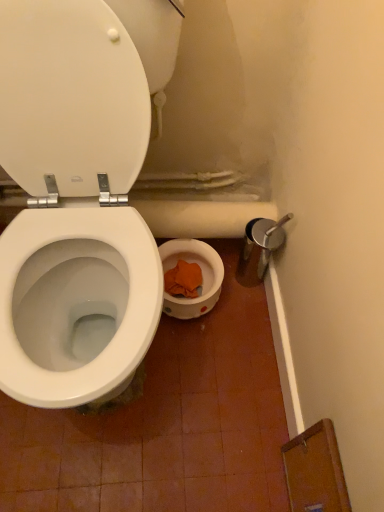
Image resolution: width=384 pixels, height=512 pixels. I want to click on white glossy toilet at center, so click(x=74, y=205).

Describe the element at coordinates (74, 205) in the screenshot. This screenshot has height=512, width=384. I see `white glossy toilet at center` at that location.

Measure the distance between white glossy toilet lid at upper left and camera.

A distance of 27.48 inches exists between white glossy toilet lid at upper left and camera.

Image resolution: width=384 pixels, height=512 pixels. I want to click on white glossy toilet lid at upper left, so click(70, 97).

The width and height of the screenshot is (384, 512). What do you see at coordinates (70, 97) in the screenshot? I see `white glossy toilet lid at upper left` at bounding box center [70, 97].

Find the location of a particular element. The width and height of the screenshot is (384, 512). white glossy toilet at center is located at coordinates (74, 205).

Between white glossy toilet at center and white glossy toilet lid at upper left, which one appears on the left side from the viewer's perspective?

Positioned to the left is white glossy toilet at center.

Is the depth of white glossy toilet at center greater than that of white glossy toilet lid at upper left?

No, white glossy toilet at center is closer to the camera.

Is point (57, 120) positioned in front of point (122, 116)?

No, it is behind (122, 116).

Looking at this image, from the image's perspective, is white glossy toilet at center beneath white glossy toilet lid at upper left?

Yes.

From a real-world perspective, which object stands above the other?

From a 3D spatial view, white glossy toilet at center is above.

Does white glossy toilet at center have a lesser width compared to white glossy toilet lid at upper left?

No.

Considering the relative sizes of white glossy toilet at center and white glossy toilet lid at upper left in the image provided, is white glossy toilet at center shorter than white glossy toilet lid at upper left?

Incorrect, the height of white glossy toilet at center does not fall short of that of white glossy toilet lid at upper left.

Considering the relative sizes of white glossy toilet at center and white glossy toilet lid at upper left in the image provided, is white glossy toilet at center smaller than white glossy toilet lid at upper left?

Incorrect, white glossy toilet at center is not smaller in size than white glossy toilet lid at upper left.

Is white glossy toilet at center outside of white glossy toilet lid at upper left?

Absolutely, white glossy toilet at center is external to white glossy toilet lid at upper left.

Are white glossy toilet at center and white glossy toilet lid at upper left beside each other?

Indeed, white glossy toilet at center and white glossy toilet lid at upper left are beside each other and touching.

Is white glossy toilet at center looking in the opposite direction of white glossy toilet lid at upper left?

That's right, white glossy toilet at center is facing away from white glossy toilet lid at upper left.

You are a GUI agent. You are given a task and a screenshot of the screen. Output one action in this format:
    pyautogui.click(x=<x>, y=<y>)
    Task: Click on the lid above the white glossy toilet at center (from the image's perspective)
    The image size is (384, 512).
    Given the screenshot: What is the action you would take?
    pyautogui.click(x=70, y=97)

Based on their positions, is white glossy toilet lid at upper left located to the left or right of white glossy toilet at center?

Clearly, white glossy toilet lid at upper left is on the right of white glossy toilet at center in the image.

Does white glossy toilet lid at upper left lie behind white glossy toilet at center?

That is True.

Which is farther from the camera, (0, 36) or (122, 140)?

The point (122, 140) is more distant.

From the image's perspective, is white glossy toilet lid at upper left above white glossy toilet at center?

Yes, from the image's perspective, white glossy toilet lid at upper left is on top of white glossy toilet at center.

Consider the image. From a real-world perspective, who is located higher, white glossy toilet lid at upper left or white glossy toilet at center?

white glossy toilet at center is physically above.

In terms of width, does white glossy toilet lid at upper left look wider or thinner when compared to white glossy toilet at center?

Considering their sizes, white glossy toilet lid at upper left looks slimmer than white glossy toilet at center.

Does white glossy toilet lid at upper left have a greater height compared to white glossy toilet at center?

No.

Which of these two, white glossy toilet lid at upper left or white glossy toilet at center, is smaller?

With smaller size is white glossy toilet lid at upper left.

Would you say white glossy toilet lid at upper left is outside white glossy toilet at center?

Actually, white glossy toilet lid at upper left is within white glossy toilet at center.

Is white glossy toilet lid at upper left placed right next to white glossy toilet at center?

Yes, white glossy toilet lid at upper left is right next to white glossy toilet at center and making contact.

Could you tell me if white glossy toilet lid at upper left is turned towards white glossy toilet at center?

Yes.

The image size is (384, 512). I want to click on toilet below the white glossy toilet lid at upper left (from the image's perspective), so click(74, 205).

Where is `lid above the white glossy toilet at center (from the image's perspective)`? lid above the white glossy toilet at center (from the image's perspective) is located at coordinates (70, 97).

The height and width of the screenshot is (512, 384). In order to click on toilet located above the white glossy toilet lid at upper left (from a real-world perspective) in this screenshot , I will do `click(74, 205)`.